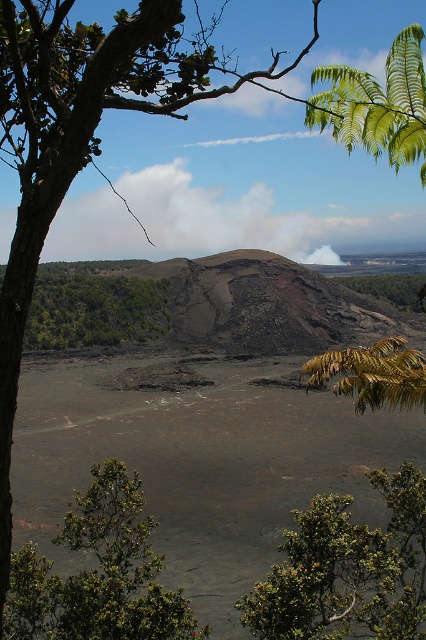
Question: Considering the real-world distances, which object is closest to the green leafy shrubs at center?

Choices:
 (A) green leafy tree at lower left
 (B) green leafy shrub at lower center

Answer: (A)

Question: Can you confirm if green leafy shrub at lower center is positioned to the right of green leafy tree at lower left?

Choices:
 (A) yes
 (B) no

Answer: (A)

Question: Is green leafy tree at lower left thinner than green leafy shrubs at center?

Choices:
 (A) no
 (B) yes

Answer: (B)

Question: Which of these objects is positioned farthest from the green leafy shrub at lower center?

Choices:
 (A) green leafy tree at center
 (B) green leafy shrubs at center

Answer: (B)

Question: Observing the image, what is the correct spatial positioning of green leafy shrubs at center in reference to green leafy tree at center?

Choices:
 (A) right
 (B) left

Answer: (B)

Question: Estimate the real-world distances between objects in this image. Which object is farther from the green leafy tree at lower left?

Choices:
 (A) green leafy shrubs at center
 (B) green leafy shrub at lower center
 (C) green leafy tree at center

Answer: (A)